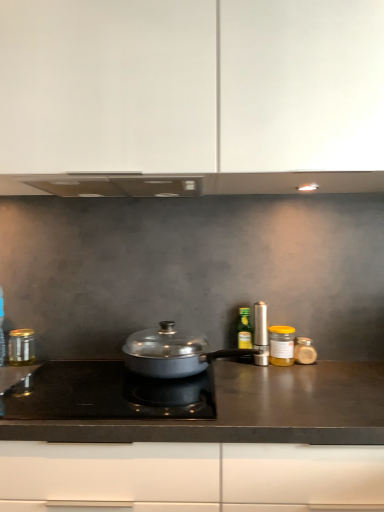
Locate an element on the screen. The image size is (384, 512). vacant space to the right of translucent glass jar at right, acting as the 6th kitchen appliance starting from the left is located at coordinates (348, 366).